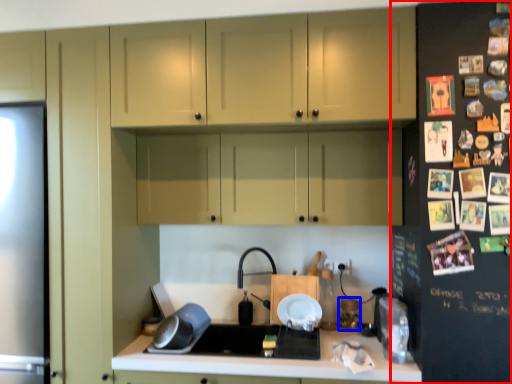
Question: Which of the following is the closest to the observer, fridge (highlighted by a red box) or appliance (highlighted by a blue box)?

Choices:
 (A) fridge
 (B) appliance

Answer: (A)